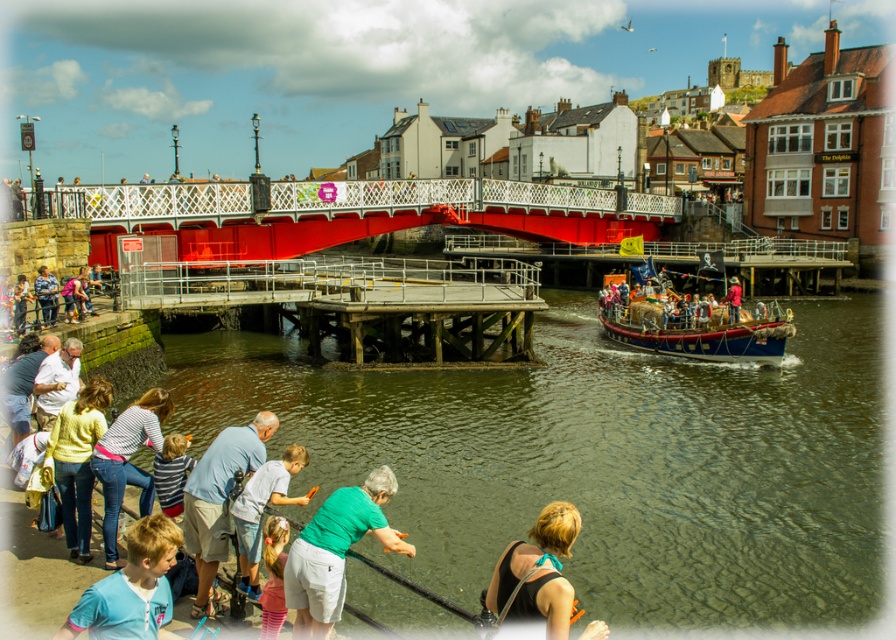
Which is behind, point (634, 323) or point (253, 547)?

The point (634, 323) is more distant.

Is point (752, 344) closer to viewer compared to point (285, 470)?

That is False.

What are the coordinates of `wooden polished boat at right` in the screenshot? It's located at (696, 326).

Does metallic red bridge at center have a larger size compared to jeans at lower left?

Correct, metallic red bridge at center is larger in size than jeans at lower left.

Is metallic red bridge at center below jeans at lower left?

No.

What are the coordinates of `metallic red bridge at center` in the screenshot? It's located at (349, 212).

At what (x,y) coordinates should I click in order to perform the action: click on metallic red bridge at center. Please return your answer as a coordinate pair (x, y). The width and height of the screenshot is (896, 640). Looking at the image, I should click on (349, 212).

Does point (106, 595) come closer to viewer compared to point (271, 499)?

Yes, it is.

Does point (151, 538) come behind point (239, 566)?

That is False.

Is point (125, 616) positioned after point (239, 582)?

That is False.

The image size is (896, 640). In order to click on blue t-shirt at lower left in this screenshot , I will do `click(131, 586)`.